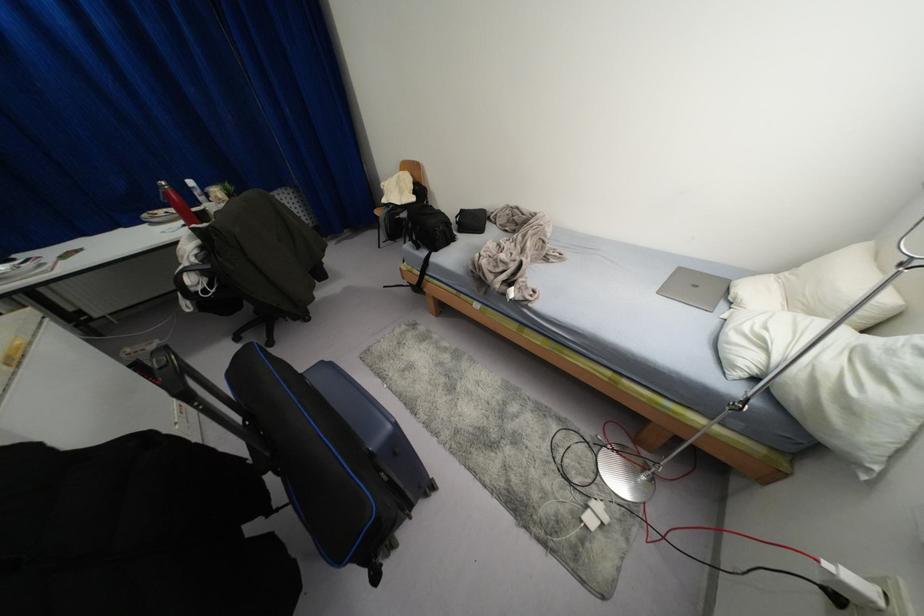
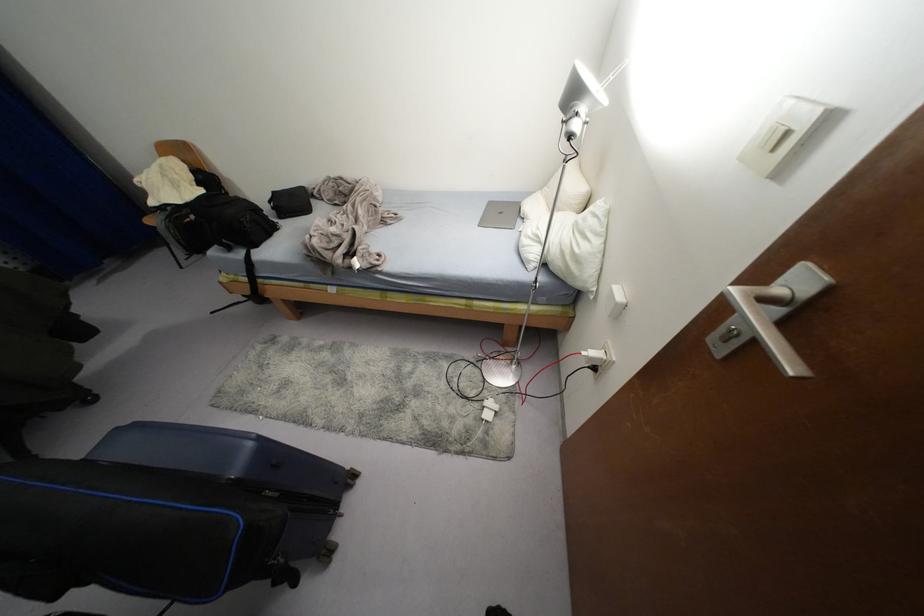
The point at (460,209) is marked in the first image. Where is the corresponding point in the second image?

(274, 192)